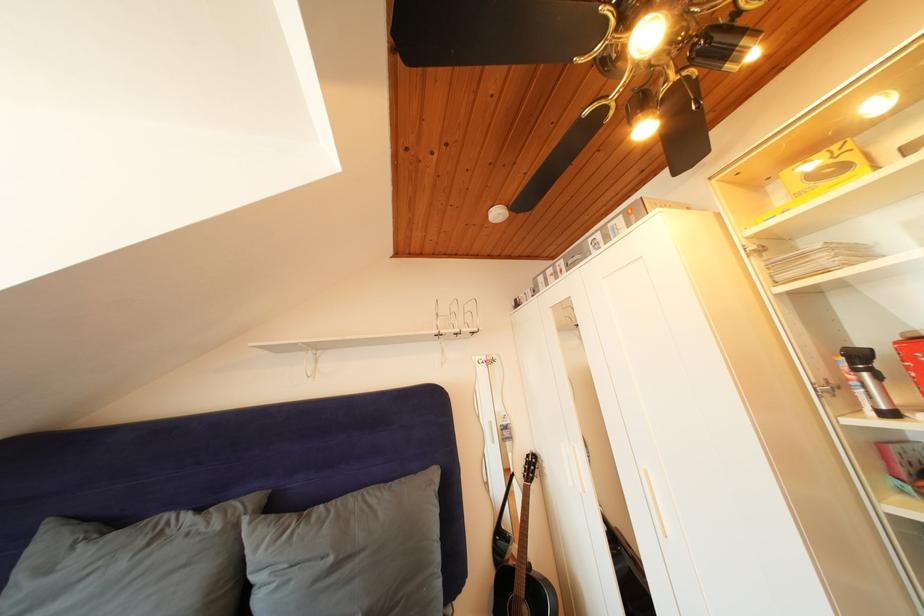
You are a GUI agent. You are given a task and a screenshot of the screen. Output one action in this format:
    pyautogui.click(x=<x>, y=<y>)
    Task: Click on the light pull chain
    This screenshot has width=924, height=616.
    Given the screenshot: What is the action you would take?
    pyautogui.click(x=310, y=363)